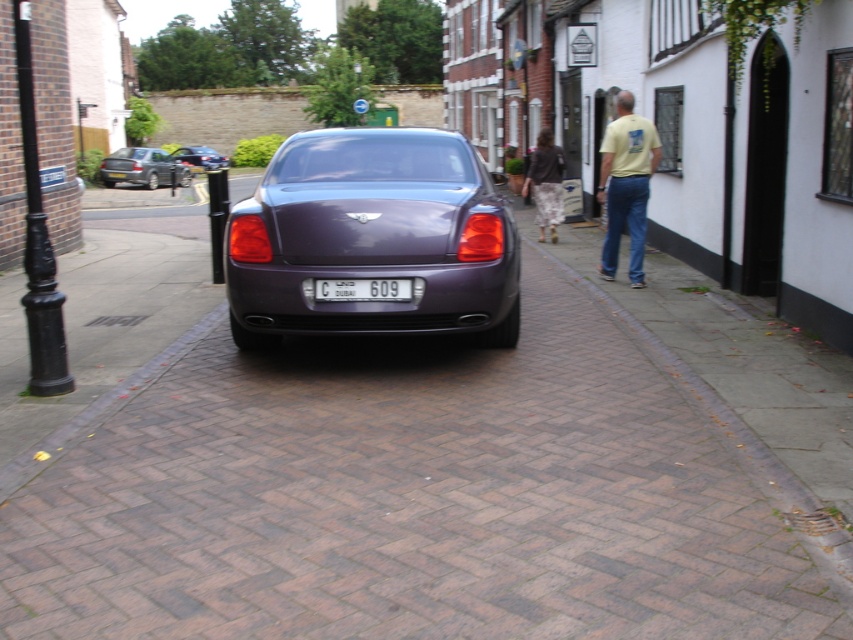
You are a delivery person who needs to park a 4.5 meter long truck between the satin purple car at center and the black lamppost on the left. Is there enough space?

The distance between the satin purple car at center and the black lamppost on the left is 4.80 meters. Since the truck is 4.5 meters long, there is enough space to park it between them.

You are a pedestrian standing on the street and want to cross to the other side. There is a satin purple car at center and camouflage pants at center in your path. Which object should you avoid first?

The satin purple car at center is in front of camouflage pants at center, so you should avoid the satin purple car at center first as it is closer to you.